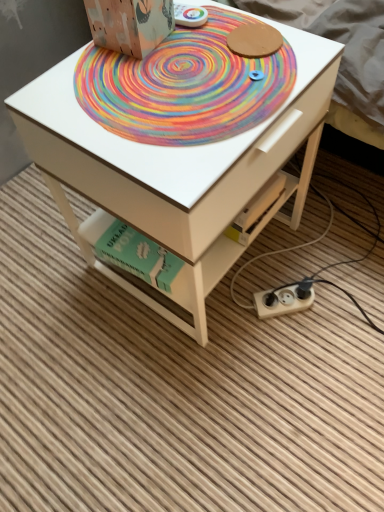
Question: Should I look upward or downward to see wooden cardboard box at upper center?

Choices:
 (A) down
 (B) up

Answer: (B)

Question: Should I look upward or downward to see white plastic plug at lower right?

Choices:
 (A) down
 (B) up

Answer: (A)

Question: Does white plastic plug at lower right have a smaller size compared to rainbow painted mat at center?

Choices:
 (A) yes
 (B) no

Answer: (A)

Question: Is rainbow painted mat at center located within white plastic plug at lower right?

Choices:
 (A) yes
 (B) no

Answer: (B)

Question: Is white plastic plug at lower right positioned behind rainbow painted mat at center?

Choices:
 (A) no
 (B) yes

Answer: (B)

Question: Can you confirm if white plastic plug at lower right is thinner than rainbow painted mat at center?

Choices:
 (A) no
 (B) yes

Answer: (B)

Question: Considering the relative sizes of white plastic plug at lower right and rainbow painted mat at center in the image provided, is white plastic plug at lower right shorter than rainbow painted mat at center?

Choices:
 (A) no
 (B) yes

Answer: (A)

Question: Is rainbow painted mat at center at the back of white plastic plug at lower right?

Choices:
 (A) yes
 (B) no

Answer: (B)

Question: Considering the relative sizes of white plastic plug at lower right and wooden cardboard box at upper center in the image provided, is white plastic plug at lower right wider than wooden cardboard box at upper center?

Choices:
 (A) yes
 (B) no

Answer: (B)

Question: Is white plastic plug at lower right next to wooden cardboard box at upper center and touching it?

Choices:
 (A) no
 (B) yes

Answer: (A)

Question: Could you tell me if white plastic plug at lower right is turned towards wooden cardboard box at upper center?

Choices:
 (A) yes
 (B) no

Answer: (B)

Question: Is white plastic plug at lower right behind wooden cardboard box at upper center?

Choices:
 (A) yes
 (B) no

Answer: (A)

Question: Is white plastic plug at lower right not inside wooden cardboard box at upper center?

Choices:
 (A) no
 (B) yes

Answer: (B)

Question: Can you confirm if white plastic plug at lower right is taller than wooden cardboard box at upper center?

Choices:
 (A) no
 (B) yes

Answer: (A)

Question: Are white plastic plug at lower right and green cardboard book at lower center far apart?

Choices:
 (A) no
 (B) yes

Answer: (A)